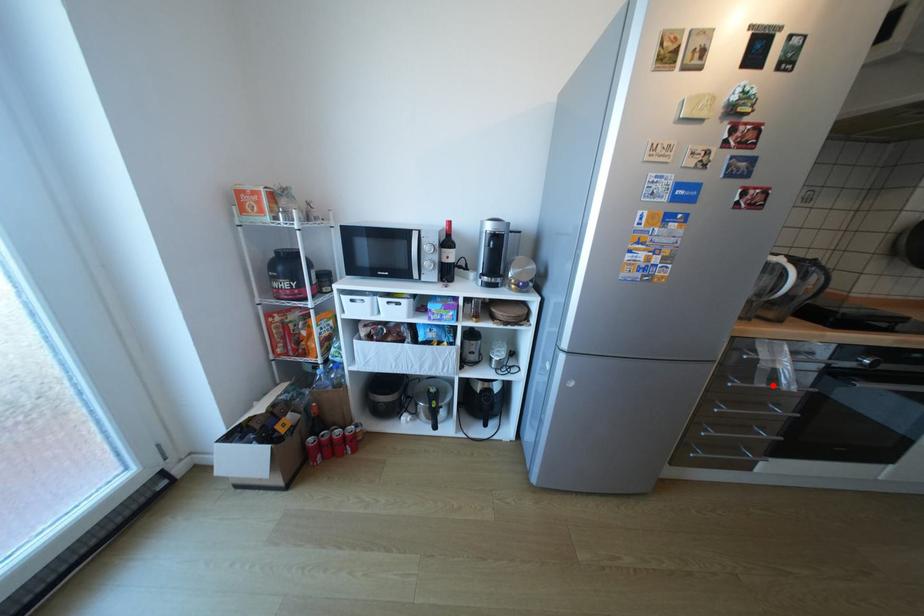
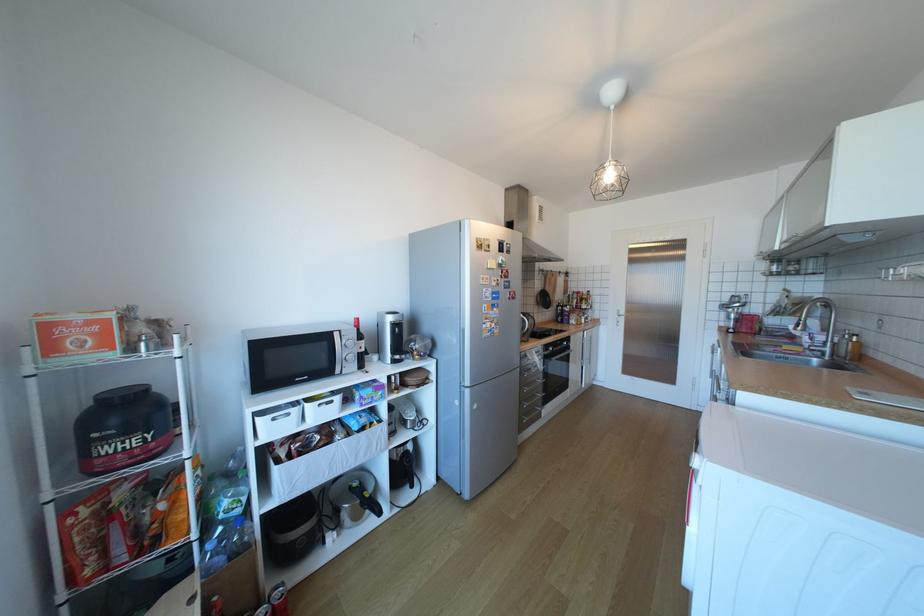
Question: I am providing you with two images of the same scene from different viewpoints. In image1, a red point is highlighted. Considering the same 3D point in image2, which of the following is correct?

Choices:
 (A) It is closer
 (B) It is farther

Answer: (B)